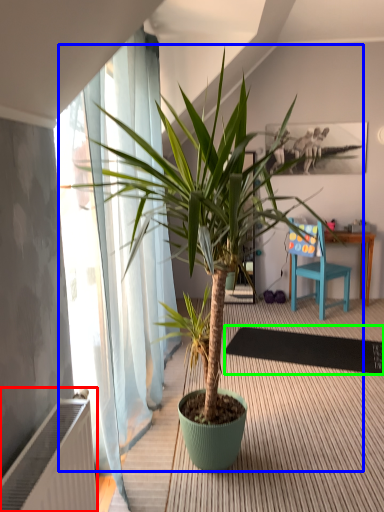
Question: Which object is positioned closest to radiator (highlighted by a red box)? Select from houseplant (highlighted by a blue box) and mat (highlighted by a green box).

Choices:
 (A) houseplant
 (B) mat

Answer: (A)